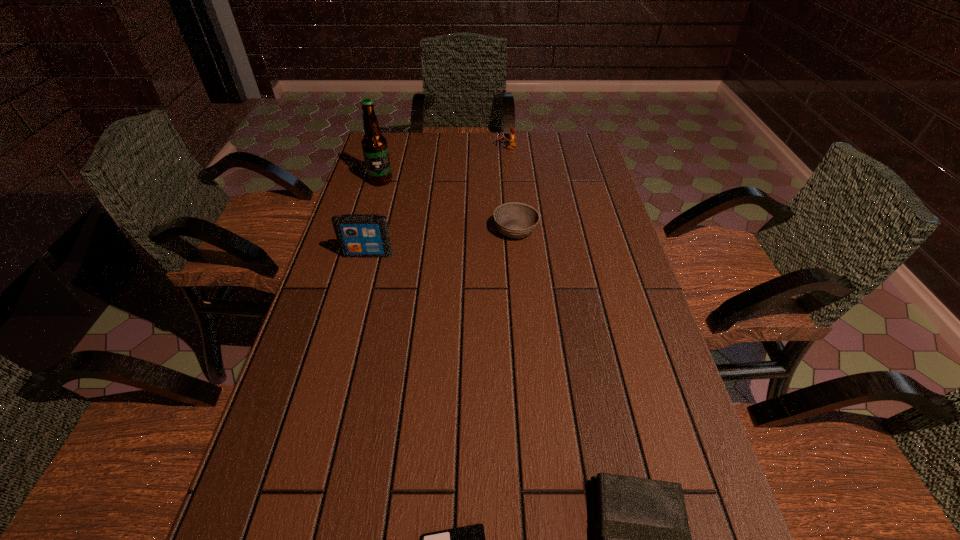
This screenshot has width=960, height=540. I want to click on free location located 0.360m holding a crossbow in the hands of the Lego, so click(x=400, y=147).

Identify the location of vacant space located holding a crossbow in the hands of the Lego. (457, 147).

Where is `free space located 0.060m on the right of the fourth nearest object`? The height and width of the screenshot is (540, 960). free space located 0.060m on the right of the fourth nearest object is located at coordinates (559, 230).

Locate an element on the screen. The width and height of the screenshot is (960, 540). object situated at the far edge is located at coordinates (511, 143).

This screenshot has width=960, height=540. Identify the location of beer bottle that is at the left edge. (374, 145).

Find the location of a particular element. This screenshot has width=960, height=540. iPod located in the left edge section of the desktop is located at coordinates (359, 235).

The height and width of the screenshot is (540, 960). In the image, there is a desktop. In order to click on blank space at the far edge in this screenshot , I will do point(487,143).

The width and height of the screenshot is (960, 540). Identify the location of vacant space at the left edge of the desktop. (312, 310).

Identify the location of vacant space at the right edge of the desktop. (612, 245).

This screenshot has width=960, height=540. I want to click on blank space at the far left corner of the desktop, so click(409, 160).